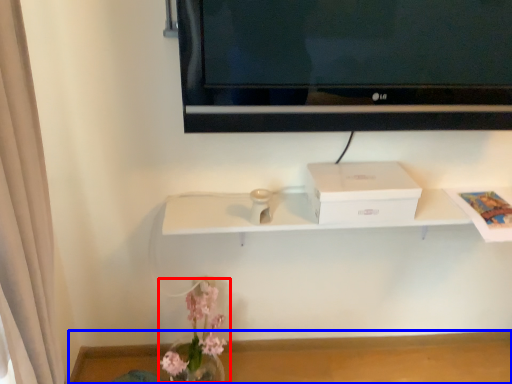
Question: Which point is further to the camera, floral arrangement (highlighted by a red box) or table (highlighted by a blue box)?

Choices:
 (A) floral arrangement
 (B) table

Answer: (B)